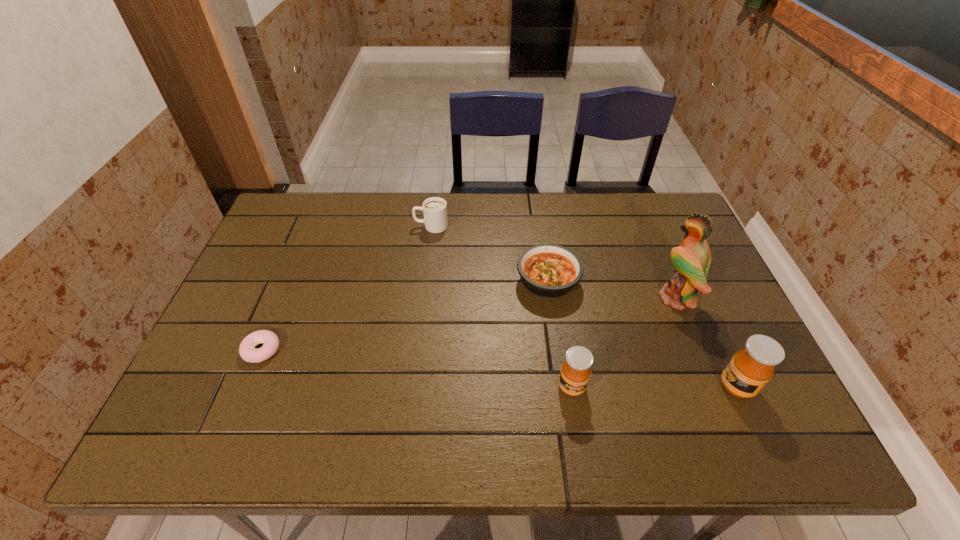
The image size is (960, 540). I want to click on vacant point located between the right honey and the tallest object, so coord(707,342).

This screenshot has width=960, height=540. In order to click on empty location between the third tallest object and the parrot in this screenshot , I will do `click(624, 342)`.

The width and height of the screenshot is (960, 540). What are the coordinates of `vacant area between the doughnut and the taller honey` in the screenshot? It's located at (499, 368).

Locate an element on the screen. The image size is (960, 540). blank region between the fifth object from right to left and the leftmost object is located at coordinates (347, 288).

The width and height of the screenshot is (960, 540). I want to click on free space between the fifth tallest object and the leftmost object, so click(x=405, y=315).

Where is `vacant area between the second tallest object and the left honey`? This screenshot has width=960, height=540. vacant area between the second tallest object and the left honey is located at coordinates (654, 387).

Identify the location of free point between the left honey and the second object from left to right. (501, 306).

Identify which object is the third closest to the taller honey. Please provide its 2D coordinates. Your answer should be formatted as a tuple, i.e. [(x, y)], where the tuple contains the x and y coordinates of a point satisfying the conditions above.

[(549, 271)]

Where is `object that can be found as the third closest to the third shortest object`? Image resolution: width=960 pixels, height=540 pixels. object that can be found as the third closest to the third shortest object is located at coordinates (575, 373).

The image size is (960, 540). What are the coordinates of `blank space that satisfies the following two spatial constraints: 1. on the side with the handle of the stew; 2. on the right side of the third shortest object` in the screenshot? It's located at (424, 281).